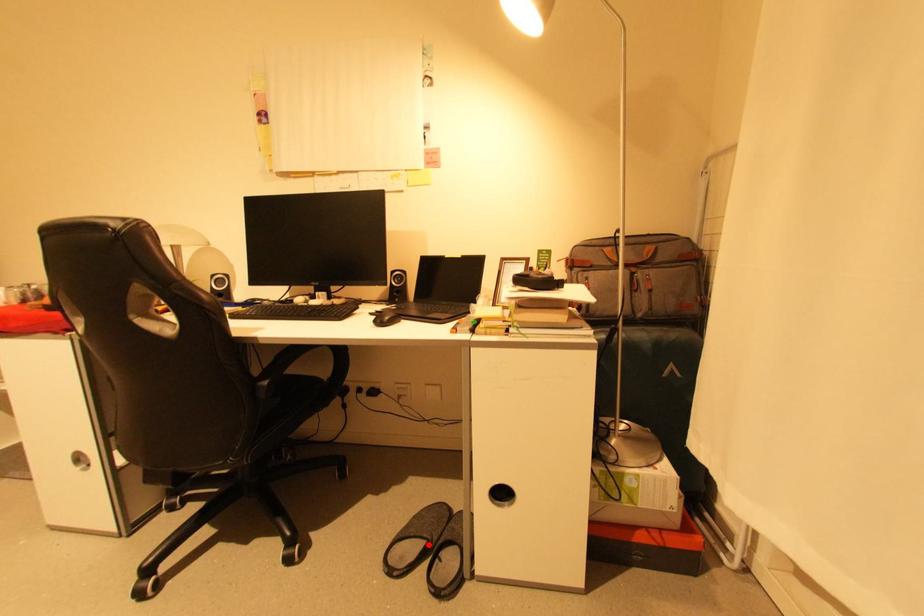
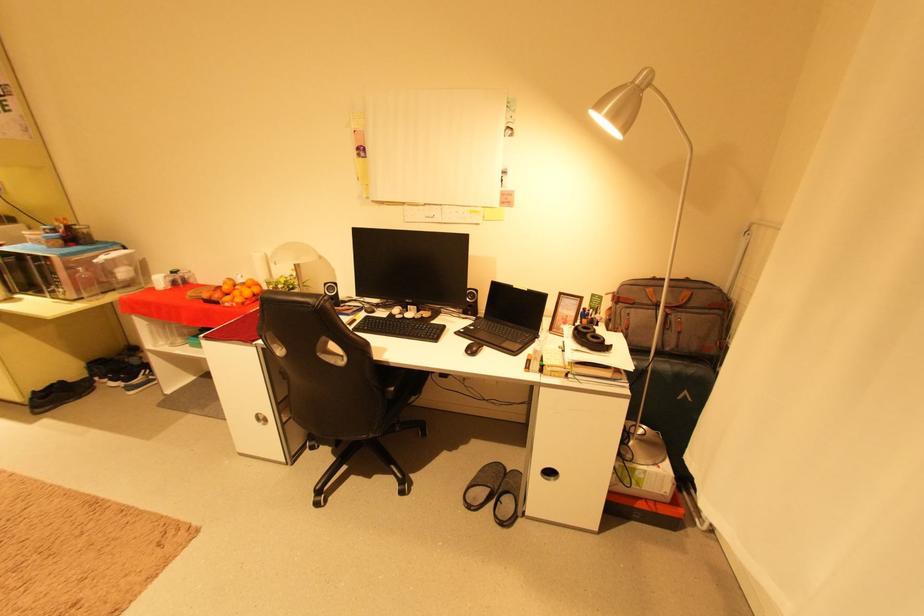
In the second image, find the point that corresponds to the highlighted location in the first image.

(494, 492)